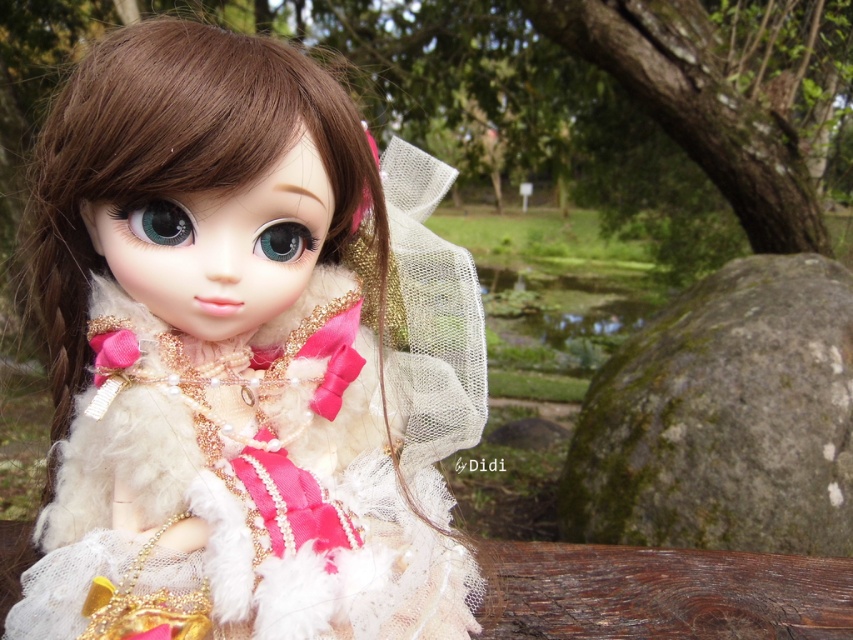
Question: Can you confirm if fuzzy white dress at center is positioned above green mossy rock at lower right?

Choices:
 (A) yes
 (B) no

Answer: (A)

Question: Which object appears farthest from the camera in this image?

Choices:
 (A) green mossy rock at lower right
 (B) fuzzy white dress at center

Answer: (A)

Question: Is the position of fuzzy white dress at center less distant than that of green mossy rock at lower right?

Choices:
 (A) yes
 (B) no

Answer: (A)

Question: Which object appears closest to the camera in this image?

Choices:
 (A) green mossy rock at lower right
 (B) fuzzy white dress at center

Answer: (B)

Question: Does fuzzy white dress at center have a larger size compared to green mossy rock at lower right?

Choices:
 (A) no
 (B) yes

Answer: (A)

Question: Which of the following is the closest to the observer?

Choices:
 (A) green mossy rock at lower right
 (B) fuzzy white dress at center

Answer: (B)